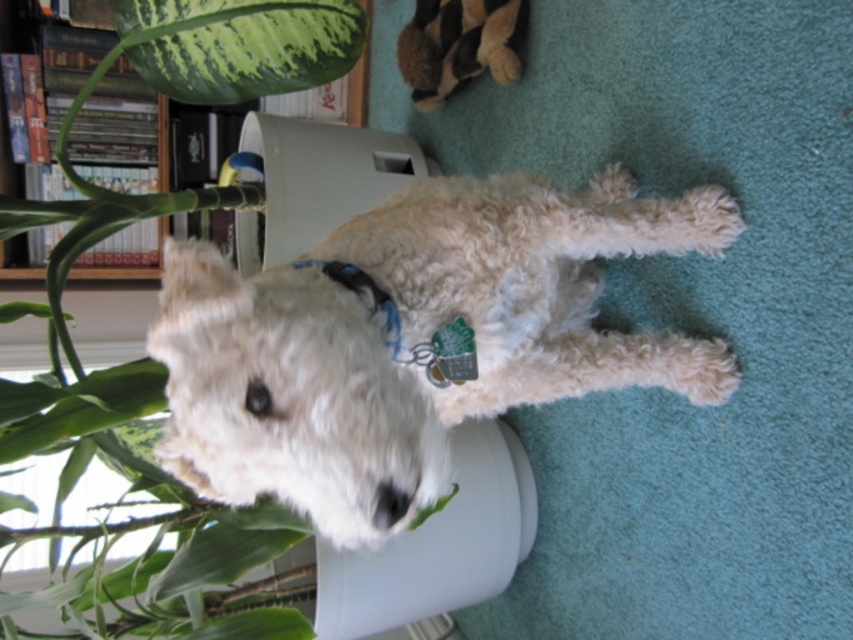
This screenshot has height=640, width=853. Identify the location of white fluffy dog at center. (415, 339).

Between point (440, 269) and point (166, 188), which one is positioned behind?

The point (166, 188) is behind.

Locate an element on the screen. The image size is (853, 640). white fluffy dog at center is located at coordinates (415, 339).

Is point (361, 268) positioned after point (434, 0)?

No, it is not.

Is point (293, 401) positioned after point (421, 88)?

No, it is in front of (421, 88).

Where is `white fluffy dog at center`? This screenshot has width=853, height=640. white fluffy dog at center is located at coordinates (415, 339).

Which is below, white fluffy dog at center or blue fabric neckband at center?

white fluffy dog at center is lower down.

Does white fluffy dog at center come behind blue fabric neckband at center?

No, it is in front of blue fabric neckband at center.

Is point (577, 381) closer to camera compared to point (399, 333)?

No, it is not.

The image size is (853, 640). Identify the location of white fluffy dog at center. pyautogui.click(x=415, y=339).